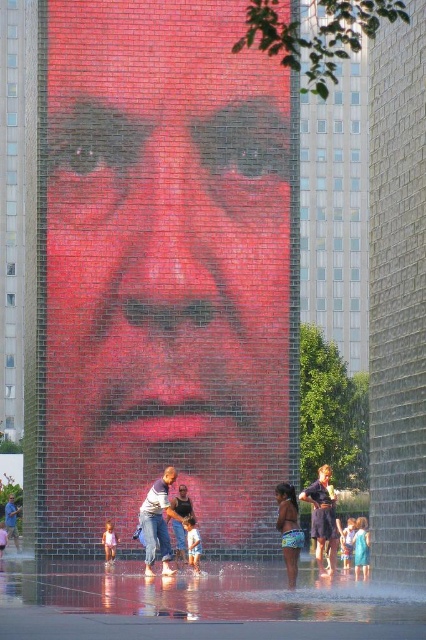
Question: Which object appears farthest from the camera in this image?

Choices:
 (A) pink fabric dress at center
 (B) smooth red face at center
 (C) light blue denim shorts at lower center
 (D) blue fabric dress at lower right

Answer: (A)

Question: Does dark blue jeans at center appear on the left side of pink fabric dress at center?

Choices:
 (A) no
 (B) yes

Answer: (A)

Question: Is clear glass water at lower center behind pink fabric dress at center?

Choices:
 (A) no
 (B) yes

Answer: (A)

Question: Estimate the real-world distances between objects in this image. Which object is closer to the pink fabric dress at center?

Choices:
 (A) blue fabric dress at lower right
 (B) smooth red face at center

Answer: (B)

Question: Is dark blue denim shorts at lower right further to camera compared to blue patterned shorts at lower center?

Choices:
 (A) no
 (B) yes

Answer: (B)

Question: Which object is farther from the camera taking this photo?

Choices:
 (A) dark blue jeans at center
 (B) dark blue denim shorts at lower right
 (C) pink fabric dress at center

Answer: (C)